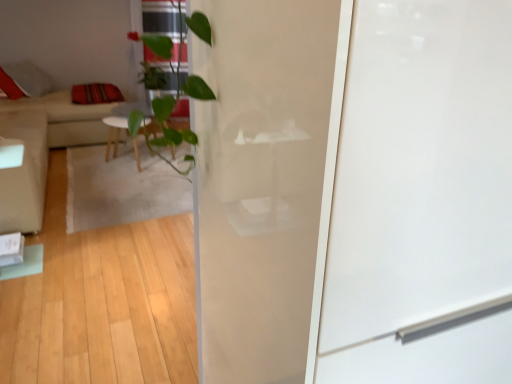
Question: Could you tell me if striped fabric pillow at left is facing transparent glass screen door at center?

Choices:
 (A) yes
 (B) no

Answer: (B)

Question: Considering the relative positions of striped fabric pillow at left and transparent glass screen door at center in the image provided, is striped fabric pillow at left behind transparent glass screen door at center?

Choices:
 (A) no
 (B) yes

Answer: (B)

Question: Would you consider striped fabric pillow at left to be distant from transparent glass screen door at center?

Choices:
 (A) no
 (B) yes

Answer: (B)

Question: Can we say striped fabric pillow at left lies outside transparent glass screen door at center?

Choices:
 (A) yes
 (B) no

Answer: (A)

Question: Is striped fabric pillow at left directly adjacent to transparent glass screen door at center?

Choices:
 (A) yes
 (B) no

Answer: (B)

Question: Is striped fabric pillow at left at the left side of transparent glass screen door at center?

Choices:
 (A) no
 (B) yes

Answer: (B)

Question: Is striped fabric pillow at left next to beige fabric couch at left?

Choices:
 (A) no
 (B) yes

Answer: (A)

Question: From a real-world perspective, is striped fabric pillow at left physically above beige fabric couch at left?

Choices:
 (A) yes
 (B) no

Answer: (A)

Question: Is striped fabric pillow at left looking in the opposite direction of beige fabric couch at left?

Choices:
 (A) yes
 (B) no

Answer: (A)

Question: Considering the relative sizes of striped fabric pillow at left and beige fabric couch at left in the image provided, is striped fabric pillow at left shorter than beige fabric couch at left?

Choices:
 (A) yes
 (B) no

Answer: (A)

Question: Does striped fabric pillow at left have a greater height compared to beige fabric couch at left?

Choices:
 (A) no
 (B) yes

Answer: (A)

Question: Is striped fabric pillow at left further to the viewer compared to beige fabric couch at left?

Choices:
 (A) no
 (B) yes

Answer: (B)

Question: Is transparent glass screen door at center facing away from beige fabric couch at left?

Choices:
 (A) no
 (B) yes

Answer: (B)